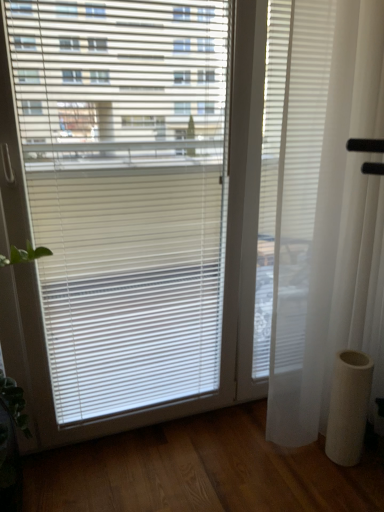
Where is `white matte cylinder at lower right`? This screenshot has height=512, width=384. white matte cylinder at lower right is located at coordinates (348, 407).

The height and width of the screenshot is (512, 384). Describe the element at coordinates (348, 407) in the screenshot. I see `white matte cylinder at lower right` at that location.

You are a GUI agent. You are given a task and a screenshot of the screen. Output one action in this format:
    pyautogui.click(x=<x>, y=<y>)
    Task: Click on the white sheer curtain at right
    This screenshot has height=512, width=384.
    Given the screenshot: What is the action you would take?
    pyautogui.click(x=327, y=214)

In order to face white sheer curtain at right, should I rotate leftwards or rightwards?

Rotate your view right by about 20.838°.

What do you see at coordinates (327, 214) in the screenshot?
I see `white sheer curtain at right` at bounding box center [327, 214].

Locate an element on the screen. This screenshot has width=384, height=512. white matte cylinder at lower right is located at coordinates (348, 407).

Does white sheer curtain at right appear on the right side of white matte cylinder at lower right?

In fact, white sheer curtain at right is to the left of white matte cylinder at lower right.

Is white sheer curtain at right further to camera compared to white matte cylinder at lower right?

No, the depth of white sheer curtain at right is less than that of white matte cylinder at lower right.

Is point (358, 68) farther from camera compared to point (343, 394)?

No, (358, 68) is in front of (343, 394).

From the picture: From the image's perspective, is white sheer curtain at right over white matte cylinder at lower right?

Yes.

From a real-world perspective, relative to white matte cylinder at lower right, is white sheer curtain at right vertically above or below?

Clearly, from a real-world perspective, white sheer curtain at right is above white matte cylinder at lower right.

Considering the sizes of white sheer curtain at right and white matte cylinder at lower right in the image, is white sheer curtain at right wider or thinner than white matte cylinder at lower right?

Considering their sizes, white sheer curtain at right looks broader than white matte cylinder at lower right.

Considering the sizes of white sheer curtain at right and white matte cylinder at lower right in the image, is white sheer curtain at right taller or shorter than white matte cylinder at lower right?

In the image, white sheer curtain at right appears to be taller than white matte cylinder at lower right.

From the picture: Is white sheer curtain at right bigger or smaller than white matte cylinder at lower right?

Considering their sizes, white sheer curtain at right takes up more space than white matte cylinder at lower right.

From the picture: Is white sheer curtain at right located outside white matte cylinder at lower right?

That's correct, white sheer curtain at right is outside of white matte cylinder at lower right.

From the picture: Is white sheer curtain at right not near white matte cylinder at lower right?

No, white sheer curtain at right is not far away from white matte cylinder at lower right.

Is white sheer curtain at right oriented towards white matte cylinder at lower right?

Yes, white sheer curtain at right is oriented towards white matte cylinder at lower right.

What's the angular difference between white sheer curtain at right and white matte cylinder at lower right's facing directions?

The facing directions of white sheer curtain at right and white matte cylinder at lower right are 49.3 degrees apart.

Measure the distance between white sheer curtain at right and white matte cylinder at lower right.

A distance of 13.33 inches exists between white sheer curtain at right and white matte cylinder at lower right.

This screenshot has height=512, width=384. What are the coordinates of `curtain that appears above the white matte cylinder at lower right (from the image's perspective)` in the screenshot? It's located at (327, 214).

Is white matte cylinder at lower right at the left side of white sheer curtain at right?

No, white matte cylinder at lower right is not to the left of white sheer curtain at right.

Considering the positions of objects white matte cylinder at lower right and white sheer curtain at right in the image provided, who is behind, white matte cylinder at lower right or white sheer curtain at right?

white matte cylinder at lower right is further away from the camera.

Which is further, (340, 381) or (342, 158)?

The point (340, 381) is farther.

From the image's perspective, between white matte cylinder at lower right and white sheer curtain at right, which one is located above?

white sheer curtain at right appears higher in the image.

From a real-world perspective, which object stands above the other?

From a 3D spatial view, white sheer curtain at right is above.

Does white matte cylinder at lower right have a lesser width compared to white sheer curtain at right?

Correct, the width of white matte cylinder at lower right is less than that of white sheer curtain at right.

Considering the relative sizes of white matte cylinder at lower right and white sheer curtain at right in the image provided, is white matte cylinder at lower right taller than white sheer curtain at right?

No.

Which of these two, white matte cylinder at lower right or white sheer curtain at right, is smaller?

white matte cylinder at lower right.

Would you say white sheer curtain at right is part of white matte cylinder at lower right's contents?

No, white sheer curtain at right is not surrounded by white matte cylinder at lower right.

Based on the photo, are white matte cylinder at lower right and white sheer curtain at right making contact?

No, white matte cylinder at lower right is not next to white sheer curtain at right.

Is white matte cylinder at lower right oriented towards white sheer curtain at right?

No.

How many degrees apart are the facing directions of white matte cylinder at lower right and white sheer curtain at right?

There is a 49.3-degree angle between the facing directions of white matte cylinder at lower right and white sheer curtain at right.

Measure the distance between white matte cylinder at lower right and white sheer curtain at right.

white matte cylinder at lower right and white sheer curtain at right are 13.33 inches apart.

Where is `pillar behind the white sheer curtain at right`? The height and width of the screenshot is (512, 384). pillar behind the white sheer curtain at right is located at coordinates (348, 407).

This screenshot has width=384, height=512. I want to click on pillar on the right of the white sheer curtain at right, so click(x=348, y=407).

In order to click on curtain that appears in front of the white matte cylinder at lower right in this screenshot , I will do `click(327, 214)`.